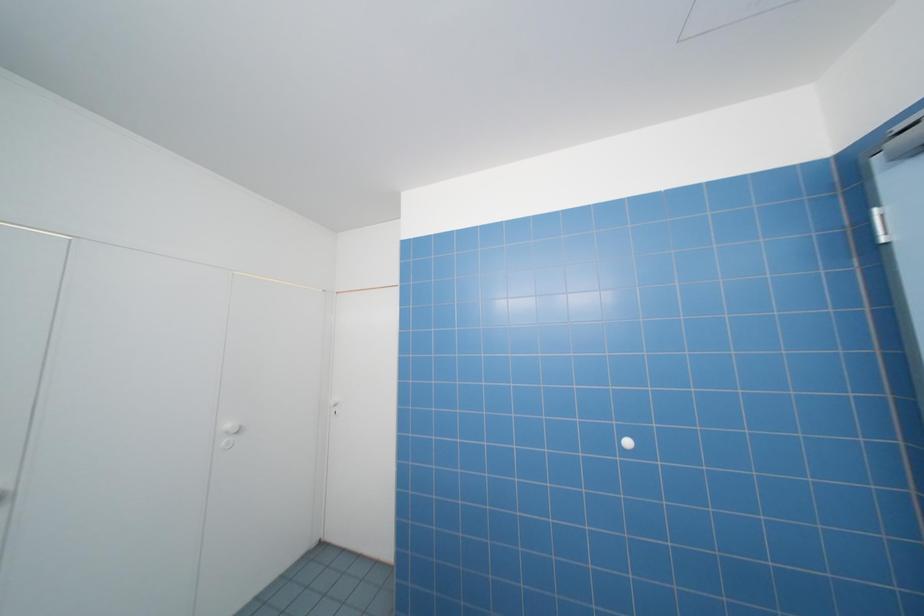
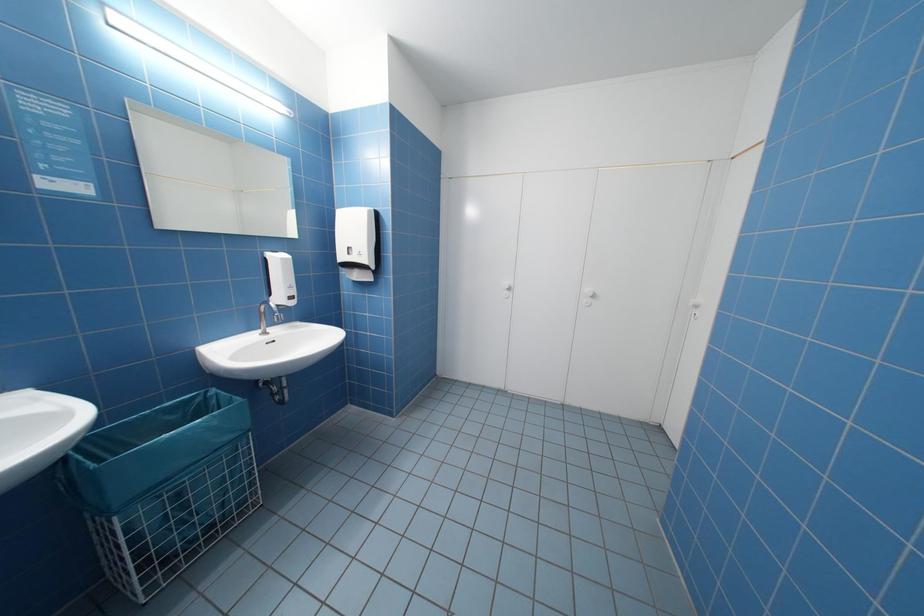
Question: Based on the continuous images, in which direction is the camera rotating? Reply with the corresponding letter.

Choices:
 (A) Left
 (B) Right
 (C) Up
 (D) Down

Answer: (A)